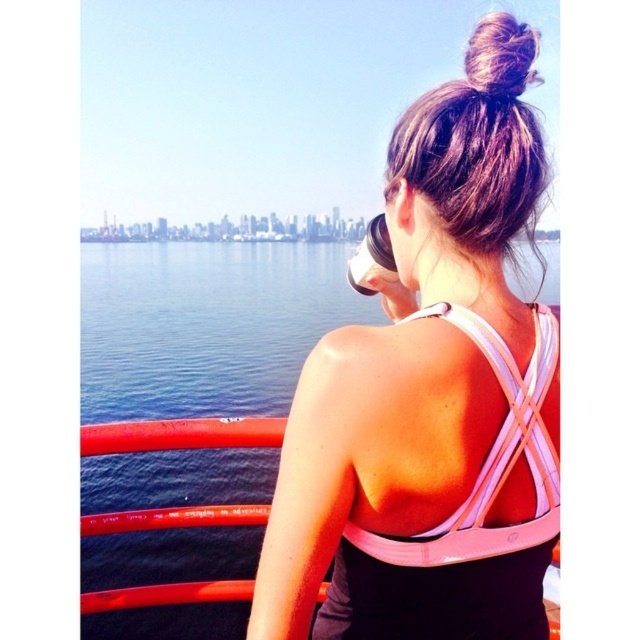
You are a photographer taking a picture of the woman in the scene. You notice the pink fabric sports bra at upper center and the brown silky hair bun at upper center. Which object is positioned lower on her back?

The pink fabric sports bra at upper center is located below the brown silky hair bun at upper center, so the pink fabric sports bra at upper center is positioned lower on her back.

You are an artist trying to sketch the scene. You need to decide which object to draw first based on their sizes. Which one should you start with, the blue water at center or the brown silky hair bun at upper center?

The blue water at center has a larger size compared to the brown silky hair bun at upper center, so you should start with the blue water at center as it occupies more space in the scene.